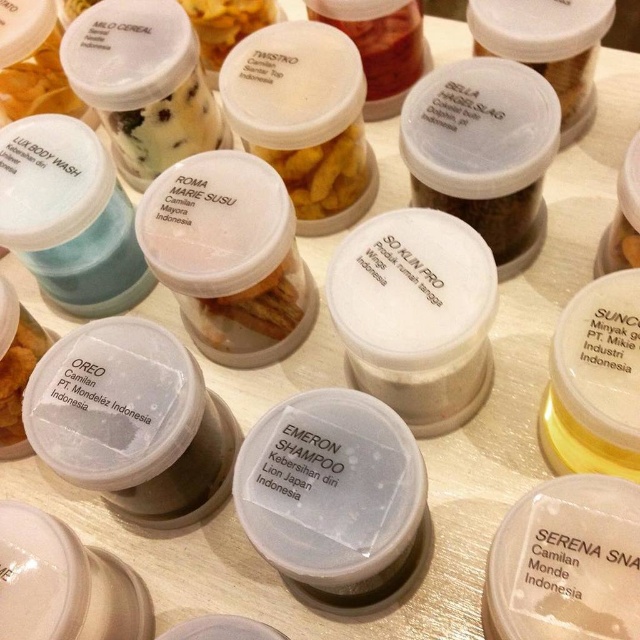
Is transparent plastic shampoo at center closer to the viewer compared to white plastic oreo at center?

Yes, it is in front of white plastic oreo at center.

Can you confirm if transparent plastic shampoo at center is positioned to the left of white plastic oreo at center?

No, transparent plastic shampoo at center is not to the left of white plastic oreo at center.

Is point (401, 531) closer to viewer compared to point (20, 352)?

Yes, it is in front of point (20, 352).

Find the location of a particular element. Image resolution: width=640 pixels, height=640 pixels. transparent plastic shampoo at center is located at coordinates point(332,492).

Can you confirm if white plastic container at upper left is positioned below white matte jar at upper center?

Incorrect, white plastic container at upper left is not positioned below white matte jar at upper center.

Which is behind, point (58, 36) or point (477, 45)?

The point (58, 36) is more distant.

You are a GUI agent. You are given a task and a screenshot of the screen. Output one action in this format:
    pyautogui.click(x=<x>, y=<y>)
    Task: Click on the white plastic container at upper left
    Image resolution: width=640 pixels, height=640 pixels.
    Given the screenshot: What is the action you would take?
    pyautogui.click(x=35, y=77)

Does point (337, 168) come in front of point (500, 244)?

That is False.

Does point (339, 204) lie in front of point (538, 237)?

No, it is not.

The image size is (640, 640). What are the coordinates of `translucent plastic snack at center top` in the screenshot? It's located at (323, 172).